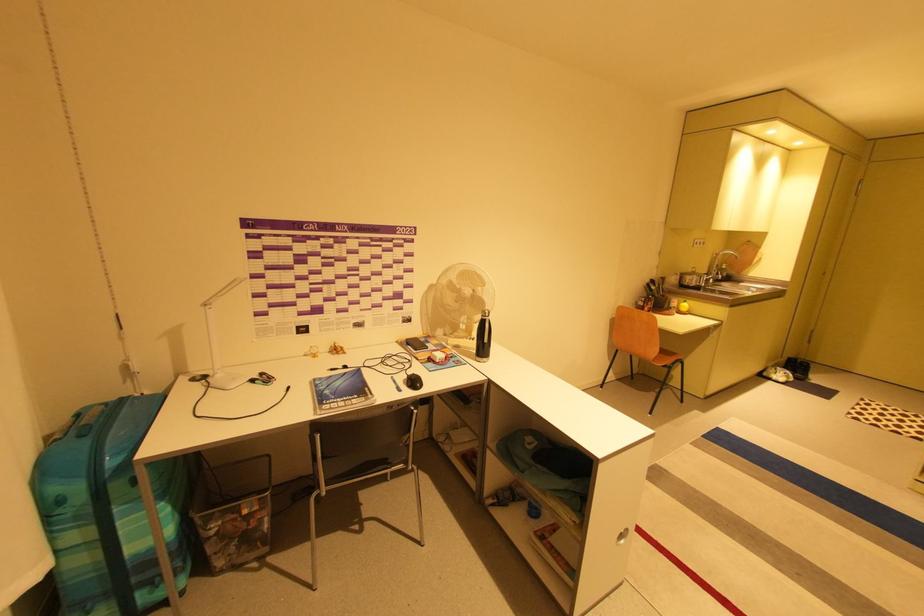
This screenshot has height=616, width=924. Find the location of `chair sitting surface`. chair sitting surface is located at coordinates (665, 357).